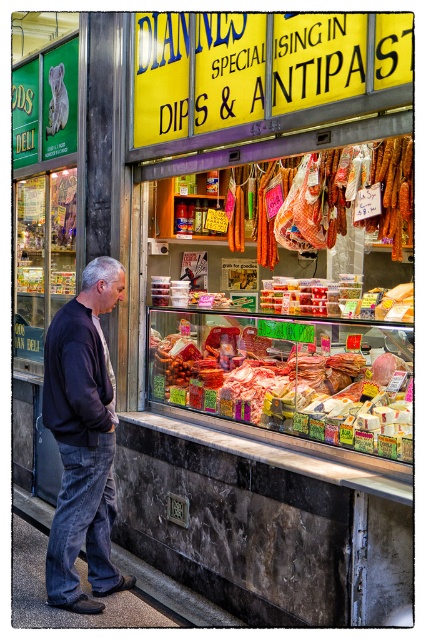
Question: Estimate the real-world distances between objects in this image. Which object is farther from the dark blue jeans at lower left?

Choices:
 (A) transparent glass display case at center
 (B) meaty red at center

Answer: (A)

Question: Does meaty red at center have a smaller size compared to transparent glass display case at center?

Choices:
 (A) yes
 (B) no

Answer: (B)

Question: Does meaty red at center appear under dark blue jeans at lower left?

Choices:
 (A) yes
 (B) no

Answer: (B)

Question: Which object appears farthest from the camera in this image?

Choices:
 (A) dark blue jeans at lower left
 (B) meaty red at center

Answer: (A)

Question: Can you confirm if meaty red at center is positioned above dark blue jeans at lower left?

Choices:
 (A) yes
 (B) no

Answer: (A)

Question: Which object appears closest to the camera in this image?

Choices:
 (A) transparent glass display case at center
 (B) dark blue jeans at lower left
 (C) meaty red at center

Answer: (C)